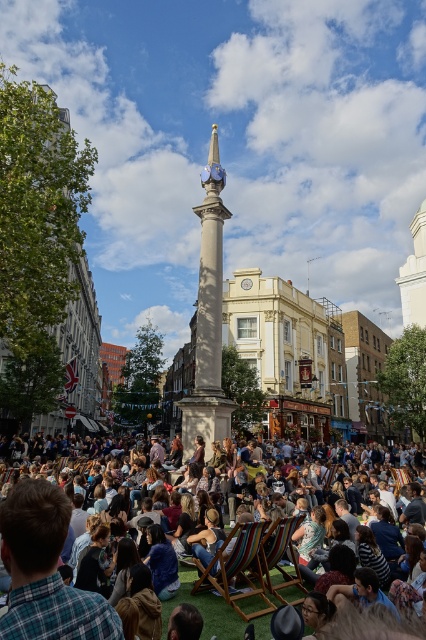
You are standing in the crowd at the festival and want to find a seat. You see the multicolored striped deck chairs at center and the multicolored fabric deck chair at center. Which one is nearer to you?

The multicolored striped deck chairs at center is closer to the viewer than multicolored fabric deck chair at center, so the multicolored striped deck chairs at center is nearer to you.

You are standing at the center of the image and want to find the smooth stone column at center. In which direction should you look?

The smooth stone column at center is located at point (209, 316), which is very close to the exact center of the image. Therefore, you should look straight ahead or directly at the center of the image to find it.

You are standing at the center of the scene facing the column. Which direction should you move to locate the plaid shirt at lower left?

You should move to the lower left direction to locate the plaid shirt at lower left since it is located at point (46,572) which is in the lower left quadrant of the image.